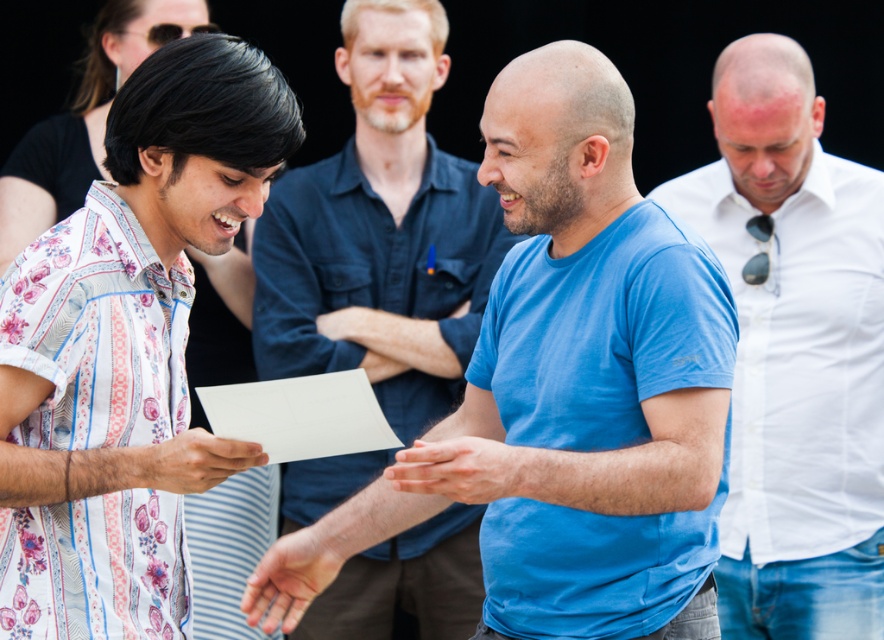
Is blue cotton shirt at center bigger than floral-patterned fabric shirt at left?

Yes, blue cotton shirt at center is bigger than floral-patterned fabric shirt at left.

Locate an element on the screen. This screenshot has width=884, height=640. blue cotton shirt at center is located at coordinates (380, 232).

This screenshot has width=884, height=640. I want to click on floral-patterned fabric shirt at left, so click(98, 330).

Is point (85, 442) less distant than point (334, 400)?

No, it is not.

Identify the location of floral-patterned fabric shirt at left. The height and width of the screenshot is (640, 884). (98, 330).

Is point (280, 371) positioned behind point (349, 401)?

Yes.

Consider the image. Can you confirm if blue cotton shirt at center is positioned to the right of white paper at center?

Correct, you'll find blue cotton shirt at center to the right of white paper at center.

The height and width of the screenshot is (640, 884). Find the location of `blue cotton shirt at center`. blue cotton shirt at center is located at coordinates tap(380, 232).